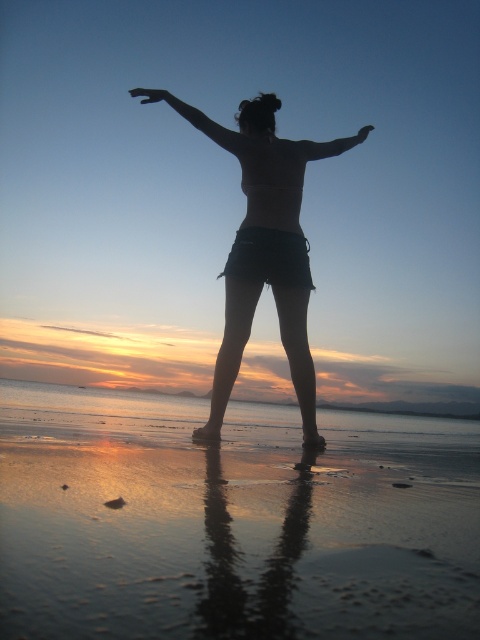
Question: Which point is farther to the camera?

Choices:
 (A) (280, 200)
 (B) (92, 577)
 (C) (330, 147)

Answer: (C)

Question: From the image, what is the correct spatial relationship of shiny wet sand at center in relation to black matte arm at upper center?

Choices:
 (A) below
 (B) above

Answer: (A)

Question: Which object is the farthest from the shiny wet sand at center?

Choices:
 (A) black matte arm at upper center
 (B) matte black arm at upper center

Answer: (B)

Question: Is black denim shorts at center to the left of matte black arm at upper center from the viewer's perspective?

Choices:
 (A) yes
 (B) no

Answer: (A)

Question: Does shiny wet sand at center appear on the right side of black matte arm at upper center?

Choices:
 (A) yes
 (B) no

Answer: (A)

Question: Which object is positioned farthest from the black denim shorts at center?

Choices:
 (A) black matte arm at upper center
 (B) shiny wet sand at center
 (C) matte black arm at upper center

Answer: (B)